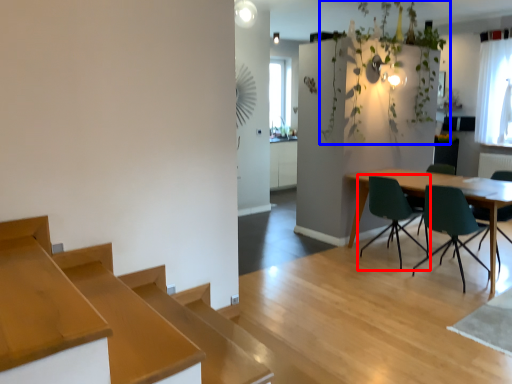
Question: Which of the following is the closest to the observer, chair (highlighted by a red box) or plant (highlighted by a blue box)?

Choices:
 (A) chair
 (B) plant

Answer: (A)